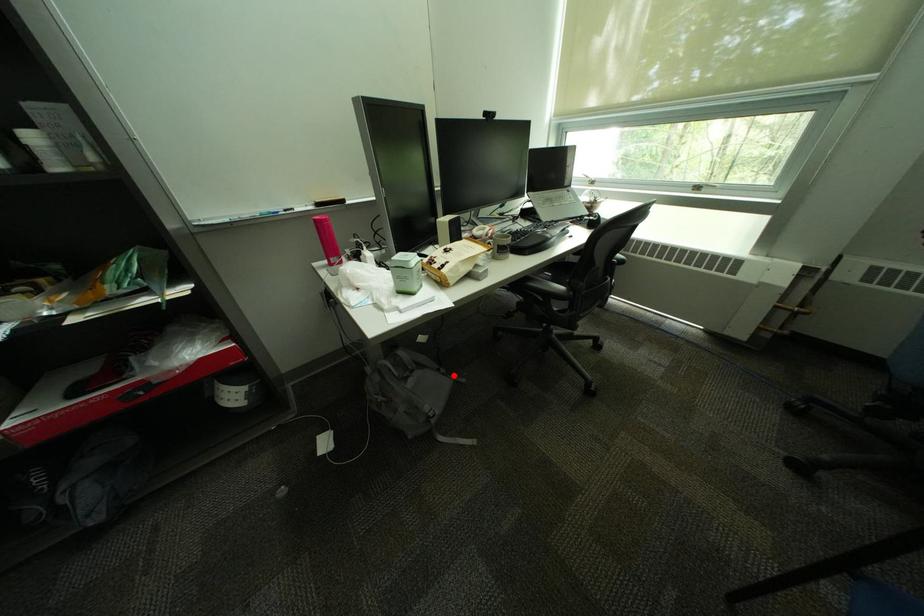
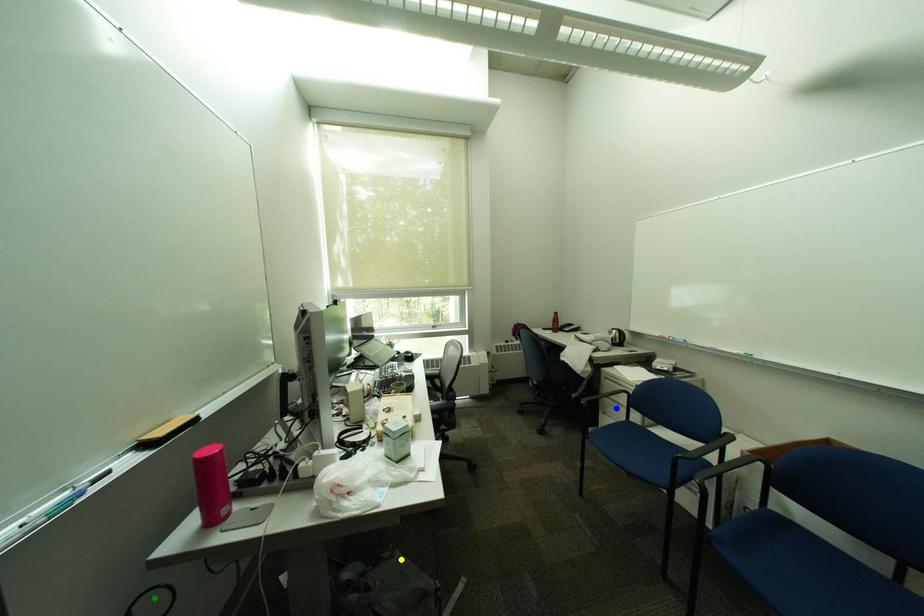
Question: I am providing you with two images of the same scene from different viewpoints. A red point is marked on the first image. You are given multiple points on the second image. Which point in image 2 is actually the same real-world point as the red point in image 1?

Choices:
 (A) blue point
 (B) yellow point
 (C) green point

Answer: (B)